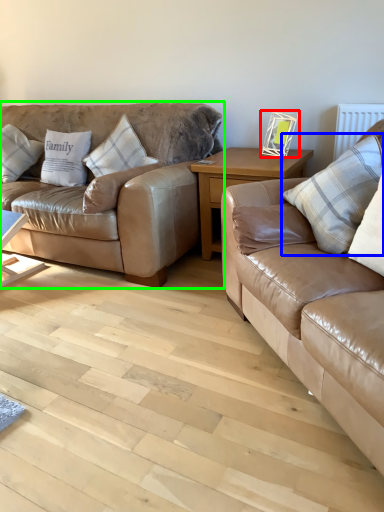
Question: Which object is the farthest from picture frame (highlighted by a red box)? Choose among these: pillow (highlighted by a blue box) or studio couch (highlighted by a green box).

Choices:
 (A) pillow
 (B) studio couch

Answer: (B)